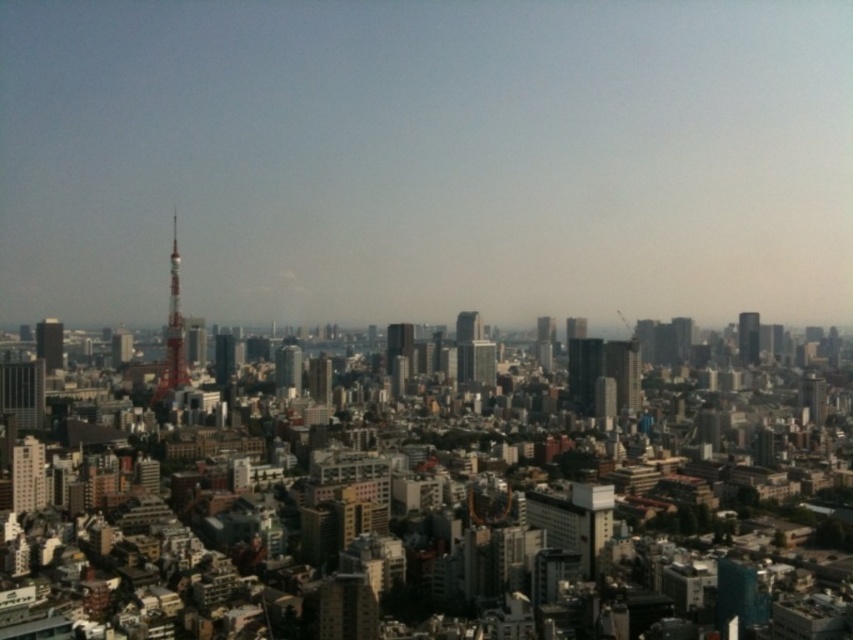
Who is positioned more to the left, red metallic tower at left or glassy reflective skyscraper at center-right?

Positioned to the left is red metallic tower at left.

Who is higher up, red metallic tower at left or glassy reflective skyscraper at center-right?

Positioned higher is red metallic tower at left.

This screenshot has height=640, width=853. Describe the element at coordinates (173, 332) in the screenshot. I see `red metallic tower at left` at that location.

Identify the location of red metallic tower at left. This screenshot has height=640, width=853. [173, 332].

Is glassy reflective skyscraper at center-right closer to camera compared to smooth glass skyscraper at center?

That is True.

Is glassy reflective skyscraper at center-right positioned behind smooth glass skyscraper at center?

No, it is in front of smooth glass skyscraper at center.

Between point (573, 380) and point (407, 349), which one is positioned behind?

The point (407, 349) is more distant.

You are a GUI agent. You are given a task and a screenshot of the screen. Output one action in this format:
    pyautogui.click(x=<x>, y=<y>)
    Task: Click on the glassy reflective skyscraper at center-right
    
    Given the screenshot: What is the action you would take?
    pyautogui.click(x=583, y=371)

Between reddish metallic tower at left and shiny glass skyscraper at right, which one has more height?

shiny glass skyscraper at right

Where is `reddish metallic tower at left`? This screenshot has height=640, width=853. reddish metallic tower at left is located at coordinates (49, 342).

Find the location of `reddish metallic tower at left`. reddish metallic tower at left is located at coordinates (49, 342).